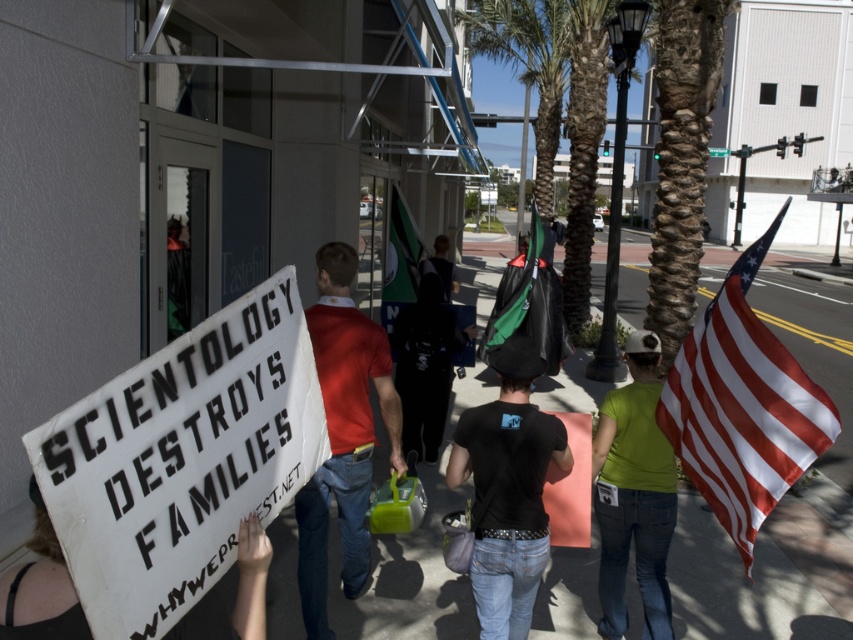
Does matte red t-shirt at center appear on the left side of black matte t-shirt at center?

Yes, matte red t-shirt at center is to the left of black matte t-shirt at center.

Can you confirm if matte red t-shirt at center is smaller than black matte t-shirt at center?

No.

Is point (349, 593) positioned in front of point (485, 616)?

No, (349, 593) is further to viewer.

What are the coordinates of `matte red t-shirt at center` in the screenshot? It's located at (341, 435).

Between matte red t-shirt at center and green fabric shirt at center, which one is positioned higher?

matte red t-shirt at center is higher up.

What are the coordinates of `matte red t-shirt at center` in the screenshot? It's located at [x=341, y=435].

This screenshot has width=853, height=640. What do you see at coordinates (341, 435) in the screenshot?
I see `matte red t-shirt at center` at bounding box center [341, 435].

Identify the location of matte red t-shirt at center. (341, 435).

The height and width of the screenshot is (640, 853). What do you see at coordinates (39, 588) in the screenshot?
I see `white cardboard sign at lower left` at bounding box center [39, 588].

In the scene shown: Is white cardboard sign at lower left to the left of green fabric flag at center from the viewer's perspective?

Correct, you'll find white cardboard sign at lower left to the left of green fabric flag at center.

Describe the element at coordinates (39, 588) in the screenshot. The height and width of the screenshot is (640, 853). I see `white cardboard sign at lower left` at that location.

Locate an element on the screen. white cardboard sign at lower left is located at coordinates (39, 588).